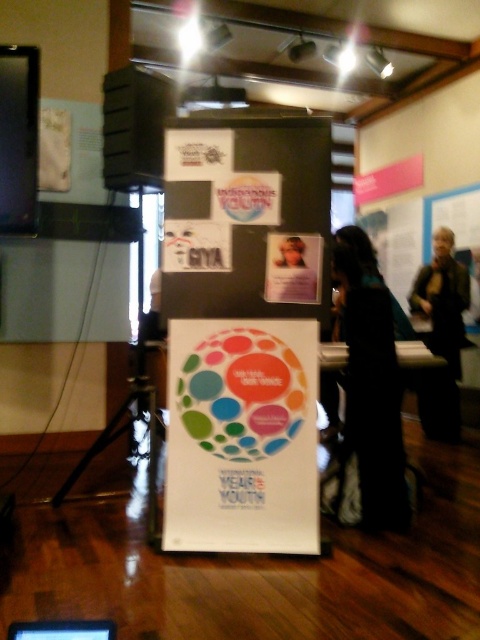
What do you see at coordinates (294, 268) in the screenshot?
I see `matte plastic photo frame at center` at bounding box center [294, 268].

Is point (311, 300) behind point (55, 624)?

Yes, it is behind point (55, 624).

Locate an element on the screen. This screenshot has height=640, width=480. matte plastic photo frame at center is located at coordinates coord(294,268).

I want to click on matte plastic photo frame at center, so click(294, 268).

Can you confirm if white paper at upper left is positioned below white glossy table at center?

No, white paper at upper left is not below white glossy table at center.

Does point (40, 188) come farther from viewer compared to point (400, 364)?

Yes, point (40, 188) is farther from viewer.

You are a GUI agent. You are given a task and a screenshot of the screen. Output one action in this format:
    pyautogui.click(x=<x>, y=<y>)
    Task: Click on the white paper at upper left
    Image resolution: width=480 pixels, height=640 pixels.
    Given the screenshot: What is the action you would take?
    pyautogui.click(x=54, y=148)

Which is above, black fabric at center or black plastic computer at lower left?

black fabric at center is higher up.

Who is more distant from viewer, [370,513] or [10,625]?

Point [370,513]

The image size is (480, 640). In order to click on black fabric at center in this screenshot , I will do `click(371, 381)`.